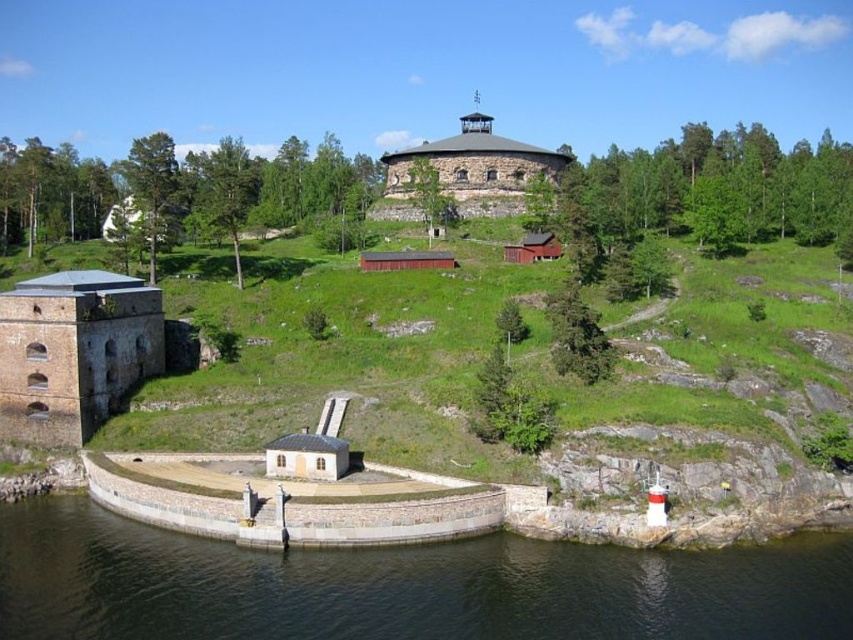
Question: Is transparent water at lower left bigger than stone tower at center?

Choices:
 (A) yes
 (B) no

Answer: (B)

Question: Considering the real-world distances, which object is closest to the brown stone fort at lower left?

Choices:
 (A) stone tower at center
 (B) transparent water at lower left

Answer: (B)

Question: Based on their relative distances, which object is farther from the brown stone fort at lower left?

Choices:
 (A) transparent water at lower left
 (B) stone tower at center

Answer: (B)

Question: Which object is farther from the camera taking this photo?

Choices:
 (A) brown stone fort at lower left
 (B) transparent water at lower left

Answer: (A)

Question: Does brown stone fort at lower left appear on the left side of stone tower at center?

Choices:
 (A) yes
 (B) no

Answer: (A)

Question: Does transparent water at lower left appear over brown stone fort at lower left?

Choices:
 (A) no
 (B) yes

Answer: (A)